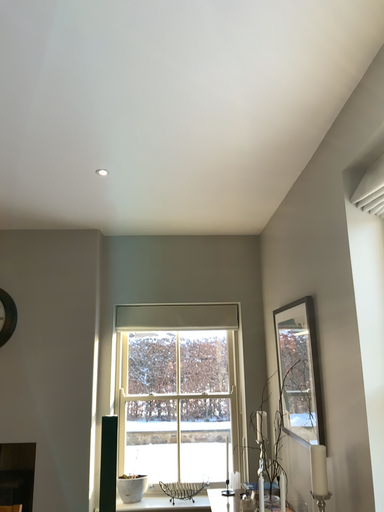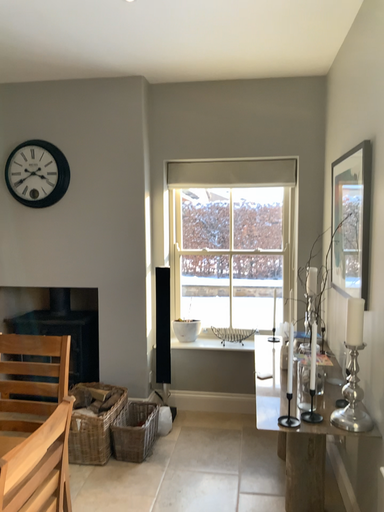
Question: How did the camera likely rotate when shooting the video?

Choices:
 (A) rotated left
 (B) rotated right

Answer: (A)